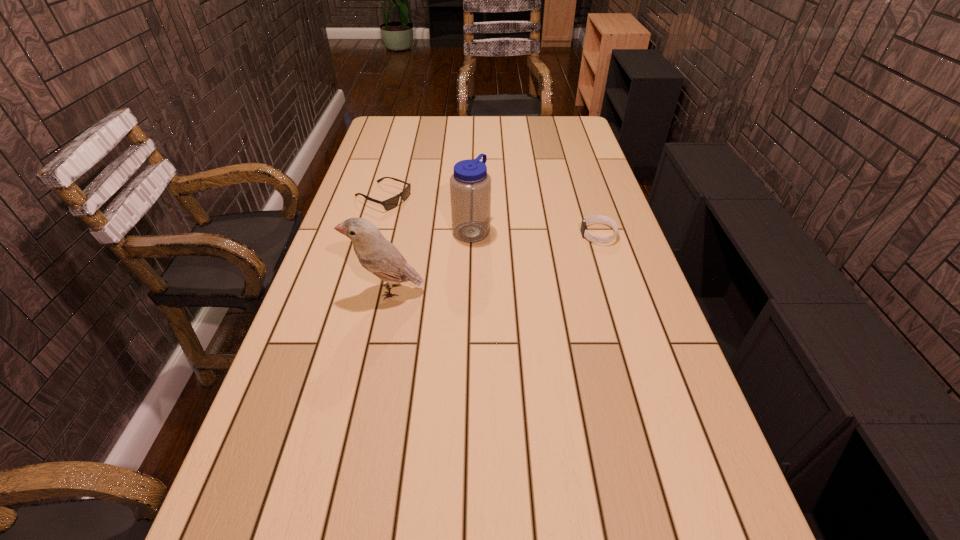
You are a GUI agent. You are given a task and a screenshot of the screen. Output one action in this format:
    pyautogui.click(x=<x>, y=<y>)
    Task: Click on the bird
    This screenshot has height=540, width=960.
    Given the screenshot: What is the action you would take?
    tap(375, 253)

Find the location of `wristband`. wristband is located at coordinates (606, 220).

The image size is (960, 540). Identify the location of sunglasses. (389, 204).

Where is `water bottle`? Image resolution: width=960 pixels, height=540 pixels. water bottle is located at coordinates (470, 185).

Image resolution: width=960 pixels, height=540 pixels. I want to click on vacant space located 0.060m at the face of the nearest object, so click(x=328, y=290).

The image size is (960, 540). I want to click on vacant space located at the face of the nearest object, so click(x=322, y=290).

Identify the location of vacant space situated 0.390m on the outer surface of the rightmost object. The image size is (960, 540). (457, 234).

The image size is (960, 540). In order to click on free region located on the outer surface of the rightmost object in this screenshot , I will do `click(549, 234)`.

This screenshot has height=540, width=960. What are the coordinates of `blank space located 0.090m on the outer surface of the rightmost object` in the screenshot? It's located at (553, 234).

Image resolution: width=960 pixels, height=540 pixels. I want to click on free space located on the front-facing side of the farthest object, so click(x=462, y=230).